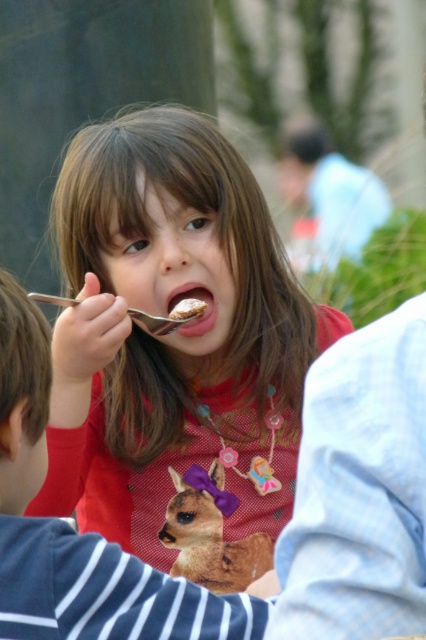
You are a photographer trying to capture a closeup of the silver metallic fork at mouth without including the striped cotton shirt at lower left in the frame. Based on their positions, is this possible?

The striped cotton shirt at lower left is closer to the viewer than the silver metallic fork at mouth, so it would block the view of the fork. Therefore, capturing a closeup of the silver metallic fork at mouth without including the striped cotton shirt at lower left is not possible.

You are a person who is 1.6 meters tall and standing in the scene. You want to reach the soft brown plush alpaca at center without moving from your current position. Can you do it by stretching your arm fully?

The soft brown plush alpaca at center and viewer are 1.98 meters apart. Since the average arm length for a person of 1.6 meters is about 0.7 meters, you cannot reach the soft brown plush alpaca at center by stretching your arm fully as the distance is greater than your arm length.